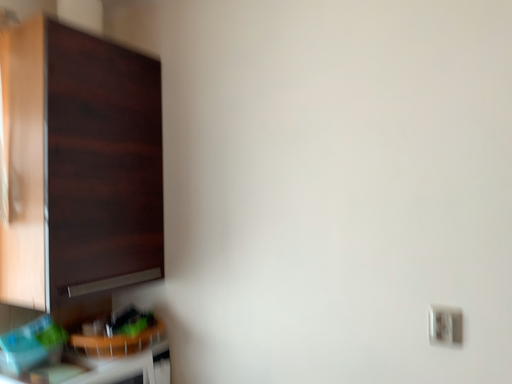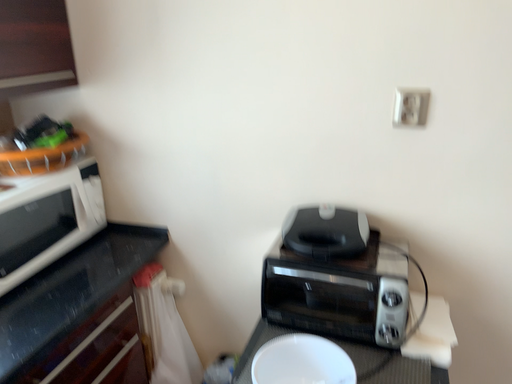
Question: How did the camera likely rotate when shooting the video?

Choices:
 (A) rotated right
 (B) rotated left

Answer: (A)